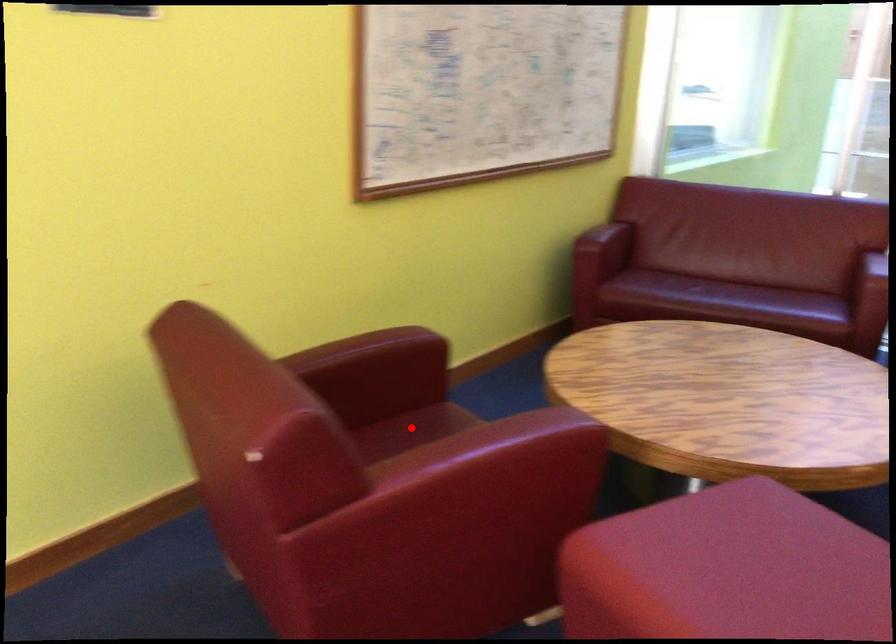
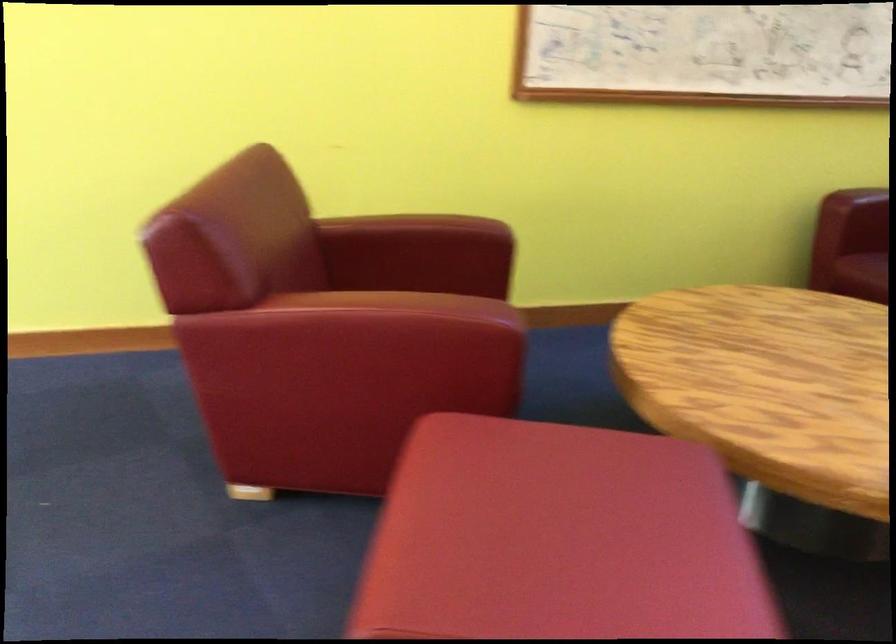
Question: I am providing you with two images of the same scene from different viewpoints. A red point is marked on the first image. Can you still see the location of the red point in image 2?

Choices:
 (A) Yes
 (B) No

Answer: (B)